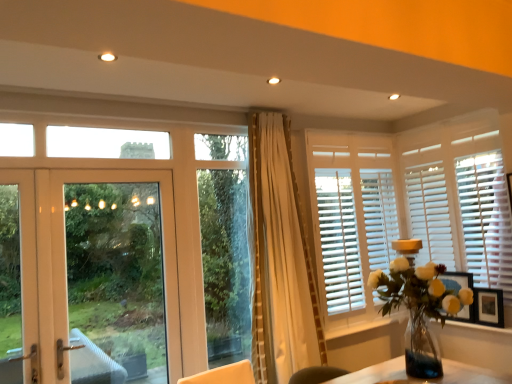
Identify the location of free point above white wood window sill at lower right (from a real-world perspective). [366, 317].